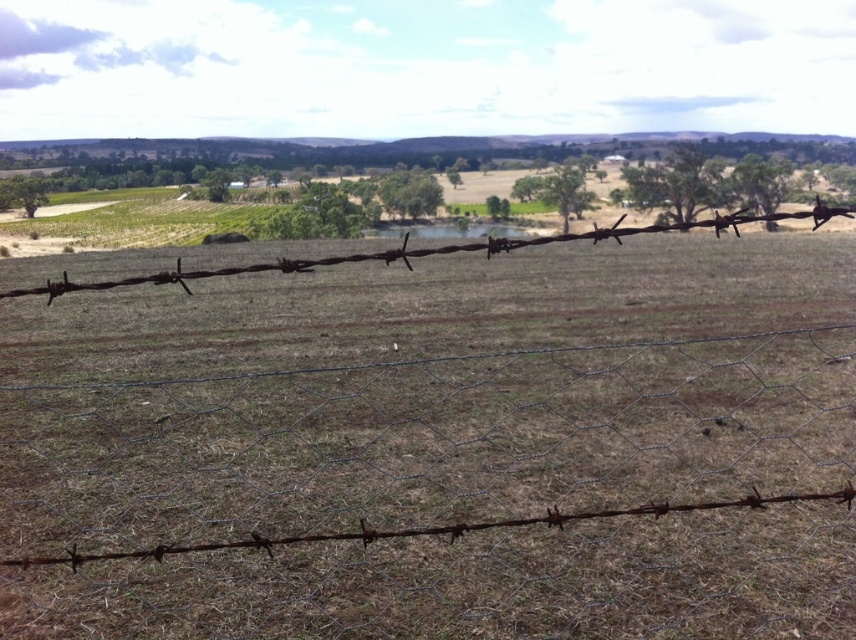
You are standing in a rural area and see the rusty wire fence at center and the rusty wire at center. Which one is closer to you?

The rusty wire at center is closer to you because the rusty wire fence at center is further away.